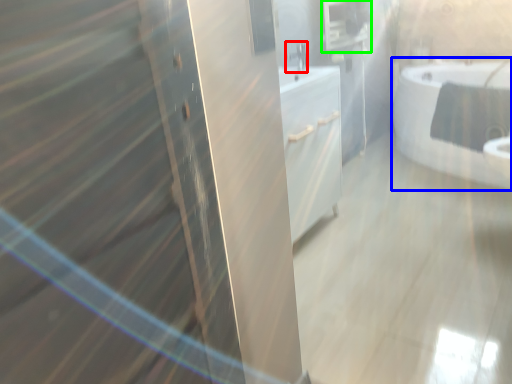
Question: Estimate the real-world distances between objects in this image. Which object is farther from faucet (highlighted by a red box), bathtub (highlighted by a blue box) or medicine cabinet (highlighted by a green box)?

Choices:
 (A) bathtub
 (B) medicine cabinet

Answer: (A)